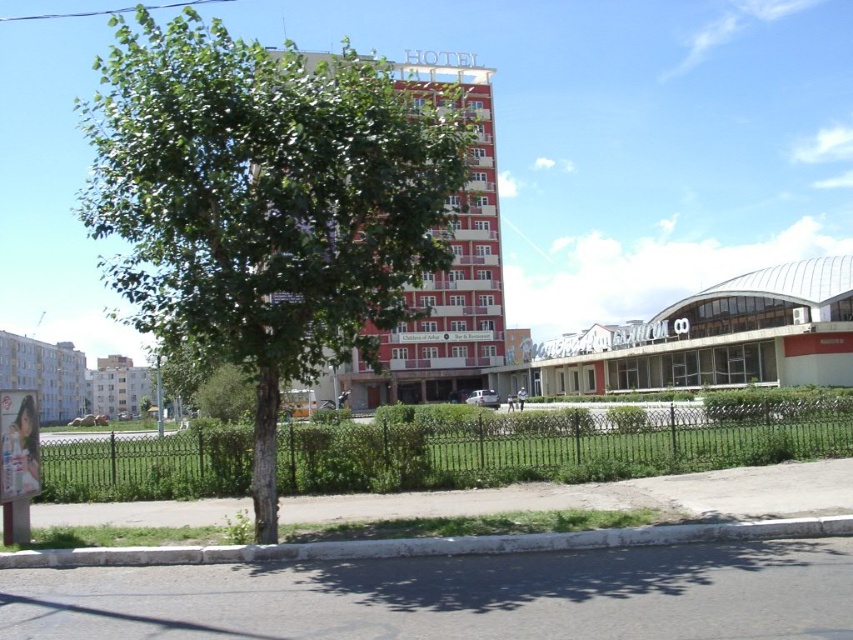
Can you confirm if green leafy tree at left is smaller than white concrete building at lower left?

No.

What do you see at coordinates (265, 204) in the screenshot? I see `green leafy tree at left` at bounding box center [265, 204].

Where is `green leafy tree at left`? Image resolution: width=853 pixels, height=640 pixels. green leafy tree at left is located at coordinates (265, 204).

Where is `green leafy tree at left`? The height and width of the screenshot is (640, 853). green leafy tree at left is located at coordinates (265, 204).

Who is taller, green leafy tree at left or white concrete building at left?

green leafy tree at left

Is green leafy tree at left positioned at the back of white concrete building at left?

That is False.

Is point (421, 212) farther from viewer compared to point (9, 385)?

No, (421, 212) is in front of (9, 385).

The width and height of the screenshot is (853, 640). Identify the location of green leafy tree at left. (265, 204).

Describe the element at coordinates (265, 204) in the screenshot. I see `green leafy tree at left` at that location.

Between point (322, 88) and point (345, 385), which one is positioned in front?

Point (322, 88)

I want to click on green leafy tree at left, so click(265, 204).